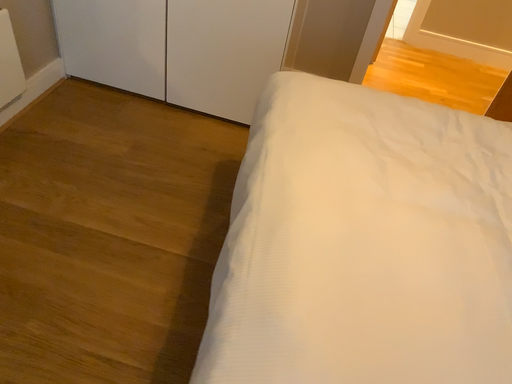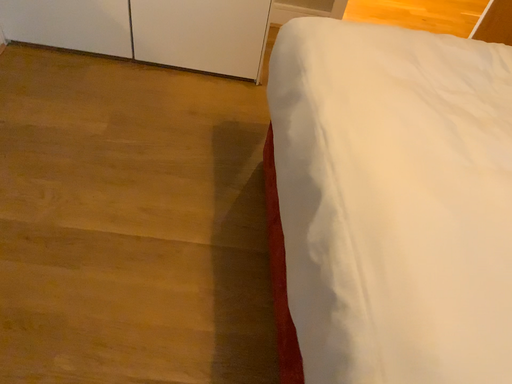
Question: How did the camera likely rotate when shooting the video?

Choices:
 (A) rotated left
 (B) rotated right

Answer: (B)